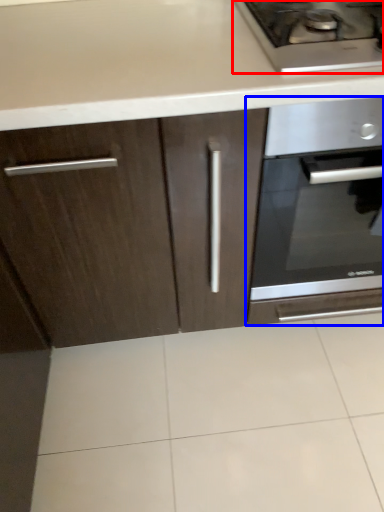
Question: Which point is closer to the camera, gas stove (highlighted by a red box) or oven (highlighted by a blue box)?

Choices:
 (A) gas stove
 (B) oven

Answer: (A)